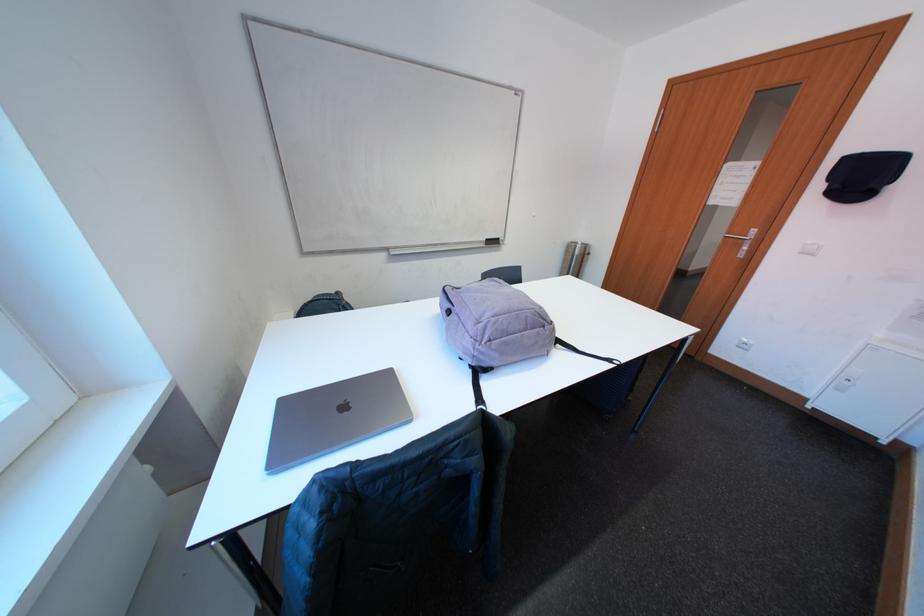
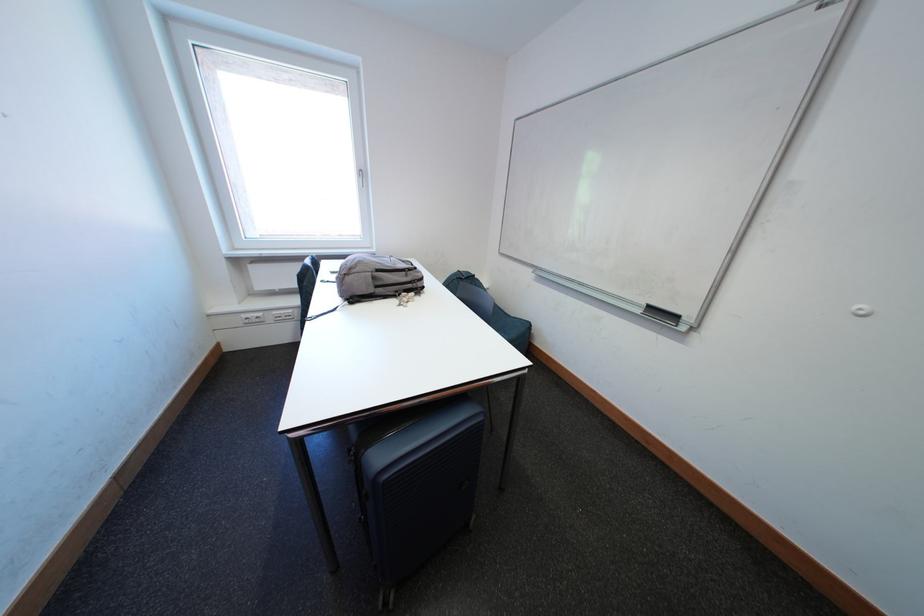
Locate, in the second image, the point that corresponds to (493,248) in the first image.

(649, 315)